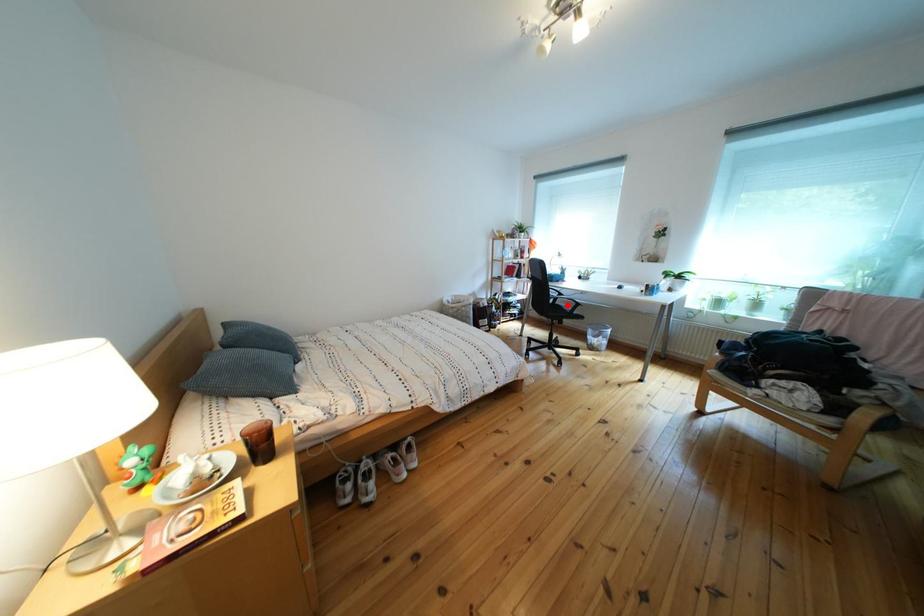
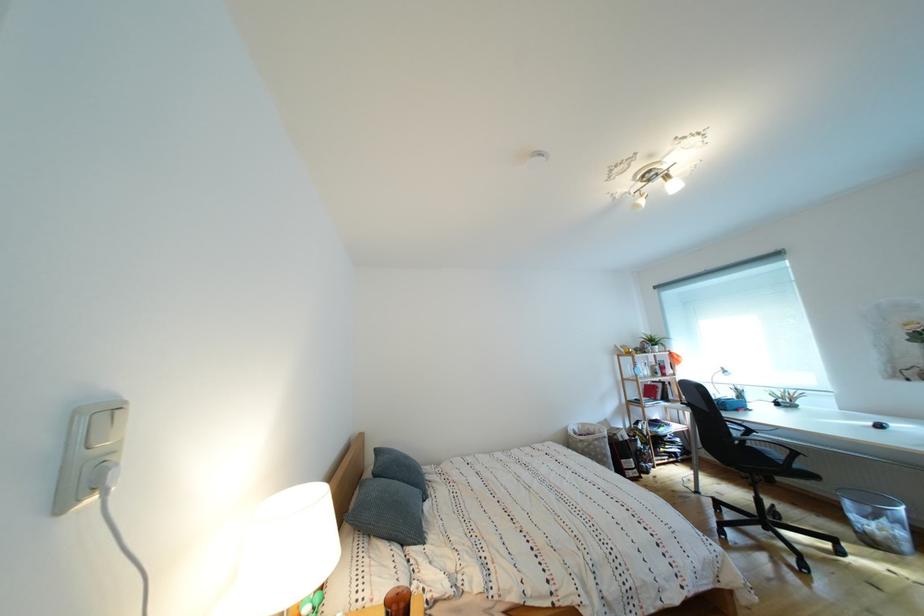
Locate, in the second image, the point that corresponds to the highlighted location in the first image.

(756, 446)